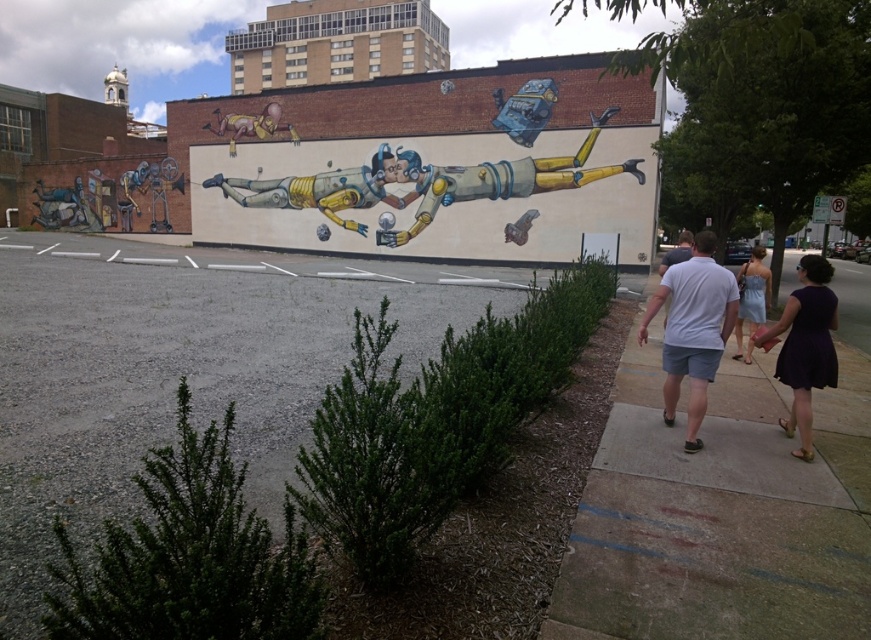
You are an urban explorer looking at the mural on the brick building. You notice the metallic yellow robot at center and the metallic gold horse at upper left. Which object in the mural is positioned lower?

The metallic yellow robot at center is positioned below the metallic gold horse at upper left, so the metallic yellow robot at center is lower in the mural.

You are an artist planning to add a new element to the mural. You have a metallic yellow robot at center and a purple satin dress at lower right. Which object should you place higher to maintain the current spatial arrangement?

The metallic yellow robot at center should be placed higher since it is positioned over the purple satin dress at lower right.

You are an architect designing a new building. You need to ensure that the metallic yellow robot at center and the purple satin dress at lower right are visible from the street level. Given their sizes, which object might require adjustments in placement to ensure visibility?

The purple satin dress at lower right might require adjustments since the metallic yellow robot at center is taller and could obstruct its view from street level.